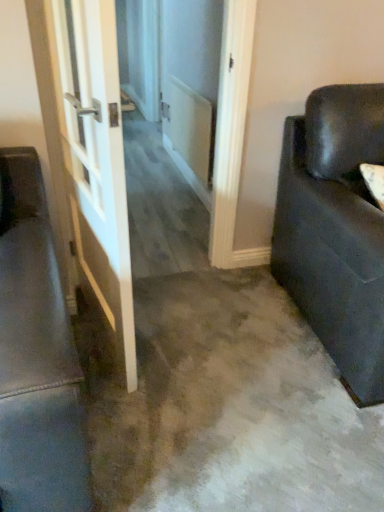
This screenshot has height=512, width=384. I want to click on matte black couch at right, so click(x=335, y=230).

What do you see at coordinates (335, 230) in the screenshot? Image resolution: width=384 pixels, height=512 pixels. I see `matte black couch at right` at bounding box center [335, 230].

Identify the location of white glossy door at left. This screenshot has height=512, width=384. (95, 156).

This screenshot has height=512, width=384. Describe the element at coordinates (95, 156) in the screenshot. I see `white glossy door at left` at that location.

Measure the distance between point (55, 77) and camera.

Point (55, 77) and camera are 4.68 feet apart from each other.

Where is `matte black couch at right`? Image resolution: width=384 pixels, height=512 pixels. matte black couch at right is located at coordinates (335, 230).

Does matte black couch at right appear on the right side of white glossy door at left?

Indeed, matte black couch at right is positioned on the right side of white glossy door at left.

Looking at this image, is matte black couch at right in front of white glossy door at left?

No, matte black couch at right is behind white glossy door at left.

Is point (322, 132) behind point (86, 125)?

Yes.

From the image's perspective, is matte black couch at right below white glossy door at left?

Indeed, from the image's perspective, matte black couch at right is shown beneath white glossy door at left.

From a real-world perspective, between matte black couch at right and white glossy door at left, who is vertically higher?

white glossy door at left is physically above.

Can you confirm if matte black couch at right is thinner than white glossy door at left?

Incorrect, the width of matte black couch at right is not less than that of white glossy door at left.

In terms of height, does matte black couch at right look taller or shorter compared to white glossy door at left?

matte black couch at right is shorter than white glossy door at left.

Who is bigger, matte black couch at right or white glossy door at left?

Bigger between the two is matte black couch at right.

Is white glossy door at left completely or partially inside matte black couch at right?

Definitely not — white glossy door at left is not inside matte black couch at right.

Does matte black couch at right touch white glossy door at left?

No, matte black couch at right is not in contact with white glossy door at left.

Is matte black couch at right facing away from white glossy door at left?

No, matte black couch at right is not facing the opposite direction of white glossy door at left.

What are the coordinates of `door to the left of matte black couch at right` in the screenshot? It's located at [95, 156].

Is white glossy door at left to the left of matte black couch at right from the viewer's perspective?

Correct, you'll find white glossy door at left to the left of matte black couch at right.

Is the position of white glossy door at left less distant than that of matte black couch at right?

Yes, white glossy door at left is closer to the camera.

Between point (107, 147) and point (364, 362), which one is positioned behind?

The point (364, 362) is farther from the camera.

From the image's perspective, is white glossy door at left on top of matte black couch at right?

Yes, from the image's perspective, white glossy door at left is over matte black couch at right.

From a real-world perspective, is white glossy door at left positioned above or below matte black couch at right?

Clearly, from a real-world perspective, white glossy door at left is above matte black couch at right.

Which object is thinner, white glossy door at left or matte black couch at right?

With smaller width is white glossy door at left.

Considering the sizes of objects white glossy door at left and matte black couch at right in the image provided, who is taller, white glossy door at left or matte black couch at right?

Standing taller between the two is white glossy door at left.

Does white glossy door at left have a smaller size compared to matte black couch at right?

Correct, white glossy door at left occupies less space than matte black couch at right.

Is white glossy door at left located outside matte black couch at right?

Yes, white glossy door at left is not within matte black couch at right.

Are white glossy door at left and matte black couch at right far apart?

white glossy door at left is near matte black couch at right, not far away.

Is white glossy door at left oriented towards matte black couch at right?

Yes, white glossy door at left is aimed at matte black couch at right.

Can you tell me how much white glossy door at left and matte black couch at right differ in facing direction?

The angular difference between white glossy door at left and matte black couch at right is 101 degrees.

Image resolution: width=384 pixels, height=512 pixels. In order to click on studio couch that is behind the white glossy door at left in this screenshot , I will do `click(335, 230)`.

Where is `studio couch behind the white glossy door at left`? This screenshot has height=512, width=384. studio couch behind the white glossy door at left is located at coordinates (335, 230).

Find the location of a particular element. This screenshot has width=384, height=512. door above the matte black couch at right (from a real-world perspective) is located at coordinates (95, 156).